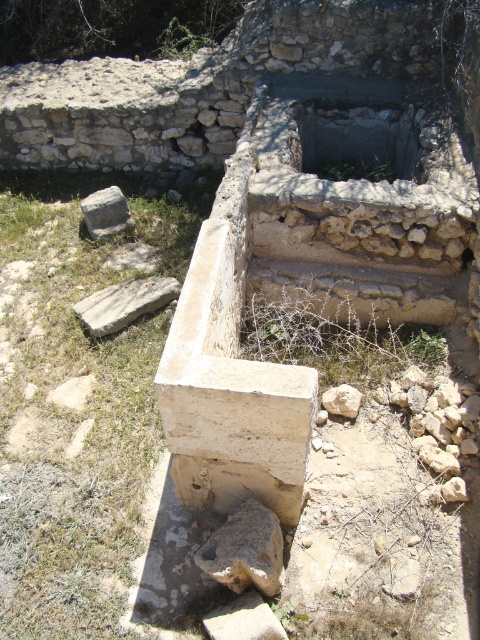
Question: Estimate the real-world distances between objects in this image. Which object is closer to the gray rough stone at lower left?

Choices:
 (A) light brown stone at lower left
 (B) white stone at center
 (C) brown rough stone at lower center

Answer: (A)

Question: Does light brown stone at lower left appear on the left side of gray rough stone at lower left?

Choices:
 (A) no
 (B) yes

Answer: (A)

Question: Does light brown stone at lower left have a lesser width compared to gray rough stone at lower left?

Choices:
 (A) yes
 (B) no

Answer: (B)

Question: Estimate the real-world distances between objects in this image. Which object is farther from the white stone at center?

Choices:
 (A) gray rough stone at lower left
 (B) light brown stone at lower left
 (C) brown rough stone at lower center

Answer: (A)

Question: Can you confirm if brown rough stone at lower center is wider than light brown stone at lower left?

Choices:
 (A) no
 (B) yes

Answer: (A)

Question: Which of the following is the closest to the observer?

Choices:
 (A) (332, 400)
 (B) (216, 566)
 (C) (108, 211)

Answer: (B)